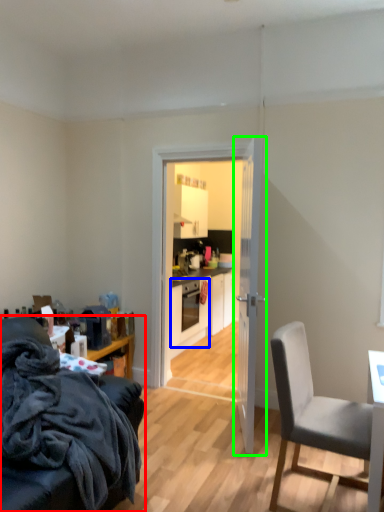
Question: Which is farther away from chair (highlighted by a red box)? oven (highlighted by a blue box) or door (highlighted by a green box)?

Choices:
 (A) oven
 (B) door

Answer: (A)